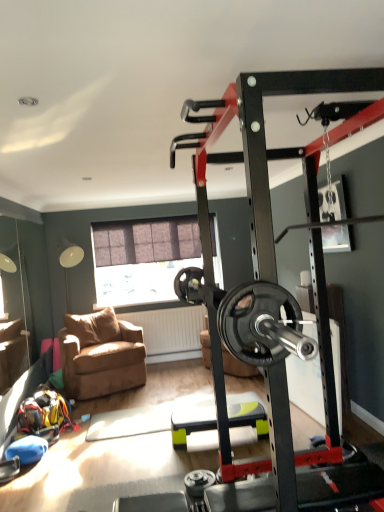
Question: Could you tell me if green plastic step platform at center is facing matte brown window at center?

Choices:
 (A) yes
 (B) no

Answer: (B)

Question: From the image's perspective, is green plastic step platform at center above matte brown window at center?

Choices:
 (A) no
 (B) yes

Answer: (A)

Question: Is green plastic step platform at center thinner than matte brown window at center?

Choices:
 (A) no
 (B) yes

Answer: (A)

Question: From a real-world perspective, is green plastic step platform at center physically below matte brown window at center?

Choices:
 (A) yes
 (B) no

Answer: (A)

Question: Is green plastic step platform at center next to matte brown window at center and touching it?

Choices:
 (A) no
 (B) yes

Answer: (A)

Question: In the image, is matte brown window at center positioned in front of or behind green plastic step platform at center?

Choices:
 (A) behind
 (B) front

Answer: (A)

Question: Is matte brown window at center wider or thinner than green plastic step platform at center?

Choices:
 (A) wide
 (B) thin

Answer: (B)

Question: From a real-world perspective, relative to green plastic step platform at center, is matte brown window at center vertically above or below?

Choices:
 (A) above
 (B) below

Answer: (A)

Question: Considering the positions of matte brown window at center and green plastic step platform at center in the image, is matte brown window at center taller or shorter than green plastic step platform at center?

Choices:
 (A) short
 (B) tall

Answer: (B)

Question: Looking at the image, does black rubber weight at center seem bigger or smaller compared to green plastic step platform at center?

Choices:
 (A) small
 (B) big

Answer: (B)

Question: From a real-world perspective, relative to green plastic step platform at center, is black rubber weight at center vertically above or below?

Choices:
 (A) below
 (B) above

Answer: (B)

Question: In the image, is black rubber weight at center positioned in front of or behind green plastic step platform at center?

Choices:
 (A) front
 (B) behind

Answer: (B)

Question: Is point (283, 325) closer or farther from the camera than point (256, 400)?

Choices:
 (A) farther
 (B) closer

Answer: (B)

Question: Is black rubber weight at center in front of or behind brown fabric chair at lower left in the image?

Choices:
 (A) behind
 (B) front

Answer: (A)

Question: From the image's perspective, is black rubber weight at center positioned above or below brown fabric chair at lower left?

Choices:
 (A) above
 (B) below

Answer: (A)